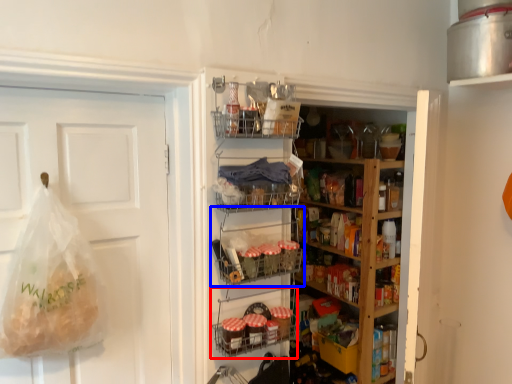
Question: Which point is closer to the camera, shelf (highlighted by a red box) or shelf (highlighted by a blue box)?

Choices:
 (A) shelf
 (B) shelf

Answer: (B)